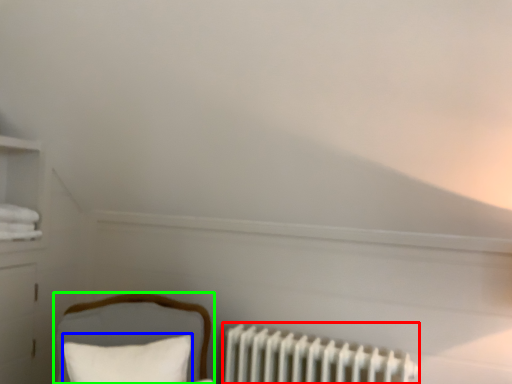
Question: Which object is the farthest from radiator (highlighted by a red box)? Choose among these: pillow (highlighted by a blue box) or furniture (highlighted by a green box).

Choices:
 (A) pillow
 (B) furniture

Answer: (A)